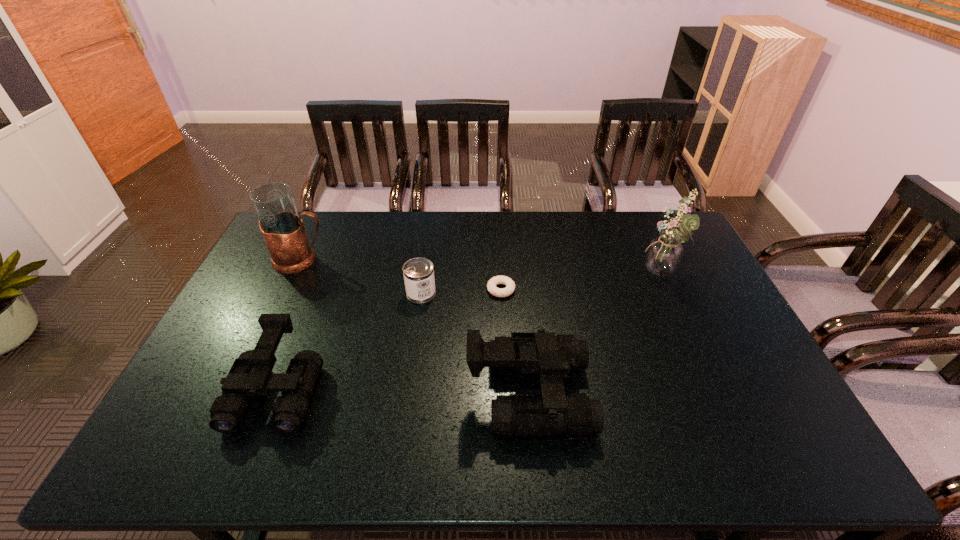
Image resolution: width=960 pixels, height=540 pixels. Identify the location of free spot between the bouquet and the right binoculars. coord(594,335).

Where is `vacant area that lies between the fifth shortest object and the shortest object`? The height and width of the screenshot is (540, 960). vacant area that lies between the fifth shortest object and the shortest object is located at coordinates (401, 275).

I want to click on free spot between the bouquet and the pitcher, so point(481,267).

You are a GUI agent. You are given a task and a screenshot of the screen. Output one action in this format:
    pyautogui.click(x=<x>, y=<y>)
    Task: Click on the vacant area that lies between the second shortest object and the doughnut
    The image size is (960, 540).
    Given the screenshot: What is the action you would take?
    pyautogui.click(x=461, y=292)

Find the location of a particular element. The image size is (960, 540). free spot between the shorter binoculars and the can is located at coordinates (349, 342).

Locate an element on the screen. object that stands as the second closest to the rightmost object is located at coordinates (491, 285).

Select which object is the fifth closest to the fourth object from right to left. Please provide its 2D coordinates. Your answer should be formatted as a tuple, i.e. [(x, y)], where the tuple contains the x and y coordinates of a point satisfying the conditions above.

[(663, 256)]

Identify the location of free spot that satisfies the following two spatial constraints: 1. with the handle on the side of the pitcher; 2. on the right side of the third object from left to right. (285, 293).

Where is `vacant space that satisfies the following two spatial constraints: 1. with the handle on the side of the second tallest object; 2. on the back side of the third object from left to right`? The width and height of the screenshot is (960, 540). vacant space that satisfies the following two spatial constraints: 1. with the handle on the side of the second tallest object; 2. on the back side of the third object from left to right is located at coordinates (285, 293).

The width and height of the screenshot is (960, 540). In order to click on free location that satisfies the following two spatial constraints: 1. with the handle on the side of the pitcher; 2. on the left side of the second shortest object in this screenshot , I will do `click(285, 293)`.